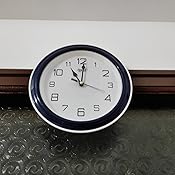
Where is `decorative pattern on wall`? The height and width of the screenshot is (175, 175). decorative pattern on wall is located at coordinates (28, 140).